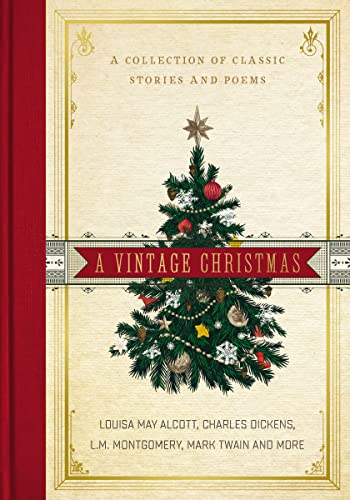
Image resolution: width=350 pixels, height=500 pixels. I want to click on main star on the top of the christmas tree, so click(196, 127).